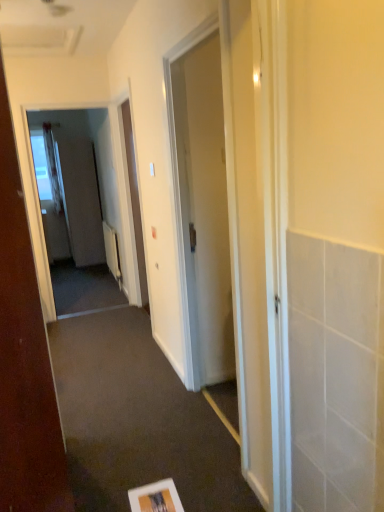
In order to face white sheer curtain at left, should I rotate leftwards or rightwards?

Rotate your view left by about 18.067°.

This screenshot has height=512, width=384. What do you see at coordinates (204, 209) in the screenshot? I see `white glossy door at center, the second door viewed from the left` at bounding box center [204, 209].

Where is `white glossy door at left, the 2th door when ordered from right to left`? The width and height of the screenshot is (384, 512). white glossy door at left, the 2th door when ordered from right to left is located at coordinates (24, 356).

Is white sheer curtain at left positioned with its back to white glossy door at left, arranged as the first door when viewed from the front?

No, white sheer curtain at left's orientation is not away from white glossy door at left, arranged as the first door when viewed from the front.

In terms of width, does white sheer curtain at left look wider or thinner when compared to white glossy door at left, which is the second door in back-to-front order?

Considering their sizes, white sheer curtain at left looks broader than white glossy door at left, which is the second door in back-to-front order.

What's the angular difference between white sheer curtain at left and white glossy door at left, arranged as the first door when viewed from the front,'s facing directions?

The angular difference between white sheer curtain at left and white glossy door at left, arranged as the first door when viewed from the front, is 71.6 degrees.

From a real-world perspective, which door is the 1st one underneath the white sheer curtain at left? Please provide its 2D coordinates.

[(24, 356)]

Which object is further away from the camera taking this photo, transparent glass screen door at left, the 1th screen door positioned from the front, or white glossy door at left, which appears as the 1th door when viewed from the left?

transparent glass screen door at left, the 1th screen door positioned from the front, is further from the camera.

Is transparent glass screen door at left, which is the 2th screen door from left to right, to the left or to the right of white glossy door at left, the 2th door when ordered from right to left, in the image?

Clearly, transparent glass screen door at left, which is the 2th screen door from left to right, is on the left of white glossy door at left, the 2th door when ordered from right to left, in the image.

Based on the photo, from the image's perspective, is transparent glass screen door at left, which is the first screen door from right to left, under white glossy door at left, the 2th door when ordered from right to left?

No.

Is point (98, 204) closer or farther from the camera than point (20, 414)?

Clearly, point (98, 204) is more distant from the camera than point (20, 414).

Could matte white screen door at left, the second screen door viewed from the front, be considered to be inside white glossy door at center, which appears as the first door when viewed from the back?

No, matte white screen door at left, the second screen door viewed from the front, is not surrounded by white glossy door at center, which appears as the first door when viewed from the back.

From the image's perspective, is white glossy door at center, which appears as the first door when viewed from the back, above or below matte white screen door at left, the 1th screen door in the left-to-right sequence?

white glossy door at center, which appears as the first door when viewed from the back, is below matte white screen door at left, the 1th screen door in the left-to-right sequence.

Would you say white glossy door at center, arranged as the 2th door when viewed from the front, is to the left or to the right of matte white screen door at left, the second screen door viewed from the front, in the picture?

From the image, it's evident that white glossy door at center, arranged as the 2th door when viewed from the front, is to the right of matte white screen door at left, the second screen door viewed from the front.

From a real-world perspective, is white glossy door at center, acting as the 1th door starting from the right, under matte white screen door at left, the first screen door when ordered from back to front?

Actually, white glossy door at center, acting as the 1th door starting from the right, is physically above matte white screen door at left, the first screen door when ordered from back to front, in the real world.

Does point (95, 176) come in front of point (64, 114)?

Yes, point (95, 176) is in front of point (64, 114).

Which is more to the right, matte white screen door at left, the 1th screen door in the left-to-right sequence, or transparent glass screen door at left, the 1th screen door positioned from the front?

From the viewer's perspective, transparent glass screen door at left, the 1th screen door positioned from the front, appears more on the right side.

What are the coordinates of `screen door in front of the matte white screen door at left, the 1th screen door in the left-to-right sequence` in the screenshot? It's located at (86, 181).

Is matte white screen door at left, the first screen door when ordered from back to front, oriented away from transparent glass screen door at left, which is the 2th screen door from left to right?

No, transparent glass screen door at left, which is the 2th screen door from left to right, is not at the back of matte white screen door at left, the first screen door when ordered from back to front.

Based on their sizes in the image, would you say matte white screen door at left, the 1th screen door in the left-to-right sequence, is bigger or smaller than white sheer curtain at left?

Clearly, matte white screen door at left, the 1th screen door in the left-to-right sequence, is larger in size than white sheer curtain at left.

Considering the positions of point (94, 248) and point (56, 198), is point (94, 248) closer or farther from the camera than point (56, 198)?

Point (94, 248) is positioned closer to the camera compared to point (56, 198).

This screenshot has height=512, width=384. What are the coordinates of `curtain above the matte white screen door at left, which is the 2th screen door in right-to-left order (from a real-world perspective)` in the screenshot? It's located at (52, 167).

From a real-world perspective, is white glossy door at left, which appears as the 1th door when viewed from the left, located beneath matte white screen door at left, which is the 2th screen door in right-to-left order?

No, from a real-world perspective, white glossy door at left, which appears as the 1th door when viewed from the left, is not below matte white screen door at left, which is the 2th screen door in right-to-left order.

Which of these two, white glossy door at left, which appears as the 1th door when viewed from the left, or matte white screen door at left, the first screen door when ordered from back to front, is wider?

matte white screen door at left, the first screen door when ordered from back to front.

From the image's perspective, is white glossy door at left, arranged as the first door when viewed from the front, positioned above or below matte white screen door at left, the 1th screen door in the left-to-right sequence?

Clearly, from the image's perspective, white glossy door at left, arranged as the first door when viewed from the front, is below matte white screen door at left, the 1th screen door in the left-to-right sequence.

Considering the sizes of objects white glossy door at center, acting as the 1th door starting from the right, and transparent glass screen door at left, marked as the second screen door in a back-to-front arrangement, in the image provided, who is wider, white glossy door at center, acting as the 1th door starting from the right, or transparent glass screen door at left, marked as the second screen door in a back-to-front arrangement,?

Wider between the two is white glossy door at center, acting as the 1th door starting from the right.

You are a GUI agent. You are given a task and a screenshot of the screen. Output one action in this format:
    pyautogui.click(x=<x>, y=<y>)
    Task: Click on the screen door above the white glossy door at center, the second door viewed from the left (from a real-world perspective)
    This screenshot has width=384, height=512.
    Given the screenshot: What is the action you would take?
    pyautogui.click(x=86, y=181)

Looking at this image, measure the distance between white glossy door at center, acting as the 1th door starting from the right, and transparent glass screen door at left, which is the 2th screen door from left to right.

white glossy door at center, acting as the 1th door starting from the right, and transparent glass screen door at left, which is the 2th screen door from left to right, are 3.55 meters apart.

Is white glossy door at center, the second door viewed from the left, oriented away from transparent glass screen door at left, which is the first screen door from right to left?

No, white glossy door at center, the second door viewed from the left,'s orientation is not away from transparent glass screen door at left, which is the first screen door from right to left.

Identify the location of the 2nd door in front of the white sheer curtain at left. (24, 356).

From the image's perspective, starting from the white glossy door at left, the 2th door when ordered from right to left, which screen door is the 1st one above? Please provide its 2D coordinates.

[(86, 181)]

Which object lies nearer to the anchor point white glossy door at left, which appears as the 1th door when viewed from the left, white glossy door at center, the second door viewed from the left, or transparent glass screen door at left, which is the 2th screen door from left to right?

Among the two, white glossy door at center, the second door viewed from the left, is located nearer to white glossy door at left, which appears as the 1th door when viewed from the left.

When comparing their distances from white glossy door at left, arranged as the first door when viewed from the front, does white sheer curtain at left or white glossy door at center, acting as the 1th door starting from the right, seem closer?

Among the two, white glossy door at center, acting as the 1th door starting from the right, is located nearer to white glossy door at left, arranged as the first door when viewed from the front.

From the image, which object appears to be farther from white sheer curtain at left, transparent glass screen door at left, the 1th screen door positioned from the front, or white glossy door at center, the second door viewed from the left?

white glossy door at center, the second door viewed from the left, is positioned further to the anchor white sheer curtain at left.

Which object lies further to the anchor point matte white screen door at left, the 1th screen door in the left-to-right sequence, white glossy door at left, which appears as the 1th door when viewed from the left, or transparent glass screen door at left, which is the 2th screen door from left to right?

white glossy door at left, which appears as the 1th door when viewed from the left, is further to matte white screen door at left, the 1th screen door in the left-to-right sequence.

Which object lies further to the anchor point transparent glass screen door at left, which is the first screen door from right to left, white sheer curtain at left or white glossy door at center, arranged as the 2th door when viewed from the front?

white glossy door at center, arranged as the 2th door when viewed from the front, lies further to transparent glass screen door at left, which is the first screen door from right to left, than the other object.

Which object lies further to the anchor point white sheer curtain at left, white glossy door at center, which appears as the first door when viewed from the back, or matte white screen door at left, the 1th screen door in the left-to-right sequence?

white glossy door at center, which appears as the first door when viewed from the back, is further to white sheer curtain at left.

When comparing their distances from white sheer curtain at left, does white glossy door at center, acting as the 1th door starting from the right, or transparent glass screen door at left, which is the 2th screen door from left to right, seem further?

white glossy door at center, acting as the 1th door starting from the right, is positioned further to the anchor white sheer curtain at left.

From the image, which object appears to be nearer to white sheer curtain at left, white glossy door at center, the second door viewed from the left, or white glossy door at left, which is the second door in back-to-front order?

Among the two, white glossy door at center, the second door viewed from the left, is located nearer to white sheer curtain at left.

What are the coordinates of `screen door between white glossy door at left, which appears as the 1th door when viewed from the left, and matte white screen door at left, which is the 2th screen door in right-to-left order, from front to back` in the screenshot? It's located at (86, 181).

Where is `door positioned between white glossy door at left, the 2th door when ordered from right to left, and transparent glass screen door at left, marked as the second screen door in a back-to-front arrangement, from near to far`? door positioned between white glossy door at left, the 2th door when ordered from right to left, and transparent glass screen door at left, marked as the second screen door in a back-to-front arrangement, from near to far is located at coordinates (204, 209).

Locate an element on the screen. The height and width of the screenshot is (512, 384). screen door between white glossy door at center, arranged as the 2th door when viewed from the front, and matte white screen door at left, which is the 2th screen door in right-to-left order, in the front-back direction is located at coordinates [x=86, y=181].

I want to click on door located between white glossy door at left, which appears as the 1th door when viewed from the left, and matte white screen door at left, which is the 2th screen door in right-to-left order, in the depth direction, so click(204, 209).